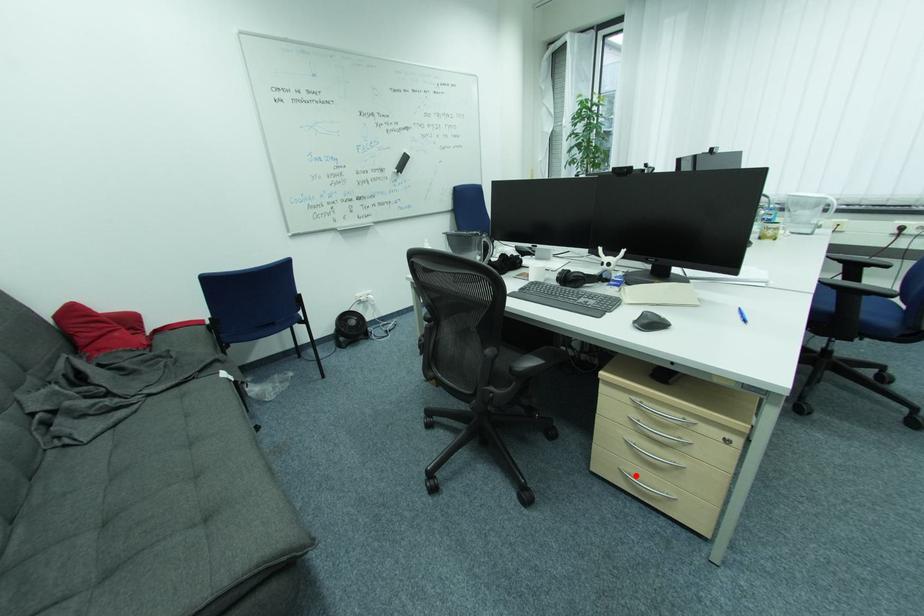
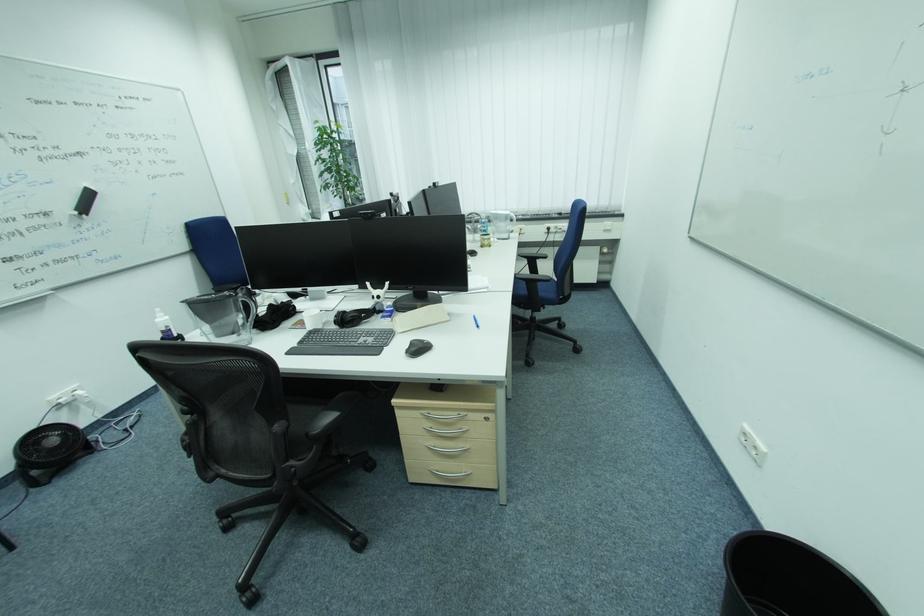
Question: I am providing you with two images of the same scene from different viewpoints. A red point is shown in image1. For the corresponding object point in image2, is it positioned nearer or farther from the camera?

Choices:
 (A) Nearer
 (B) Farther

Answer: (B)